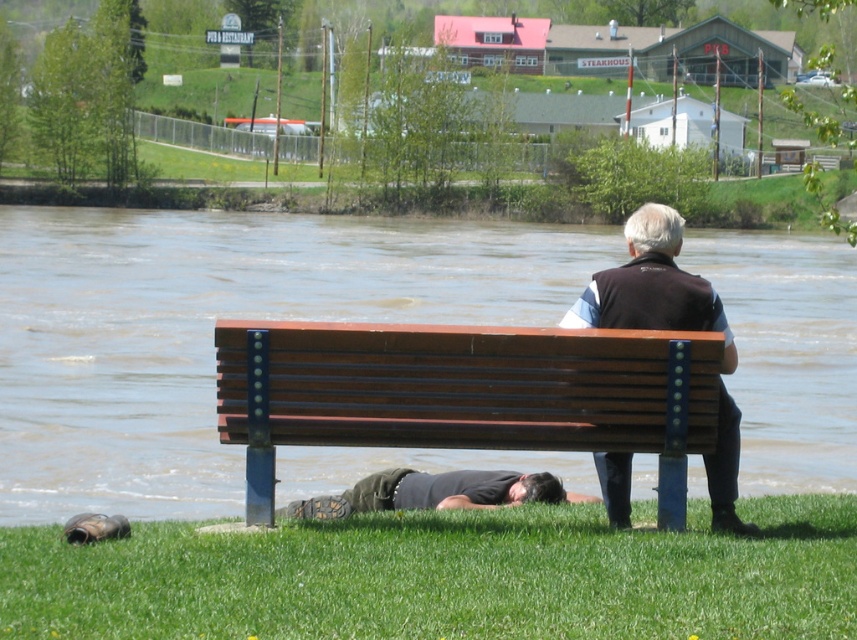
In the scene shown: Can you confirm if brown water at lower center is wider than dark gray fabric shirt at lower center?

Yes.

Measure the distance between point (198, 433) and camera.

24.09 meters

Identify the location of brown water at lower center. The image size is (857, 640). (213, 330).

Who is higher up, brown wooden bench at center or dark brown leather jacket at center?

brown wooden bench at center is above.

Can you confirm if brown wooden bench at center is smaller than dark brown leather jacket at center?

Yes, brown wooden bench at center is smaller than dark brown leather jacket at center.

Between point (312, 380) and point (609, 496), which one is positioned in front?

Point (312, 380) is more forward.

The height and width of the screenshot is (640, 857). Identify the location of brown wooden bench at center. (464, 392).

Is point (535, 352) closer to viewer compared to point (482, 492)?

Yes, point (535, 352) is in front of point (482, 492).

Between point (364, 435) and point (387, 504), which one is positioned in front?

Positioned in front is point (364, 435).

Where is `brown wooden bench at center`? brown wooden bench at center is located at coordinates (464, 392).